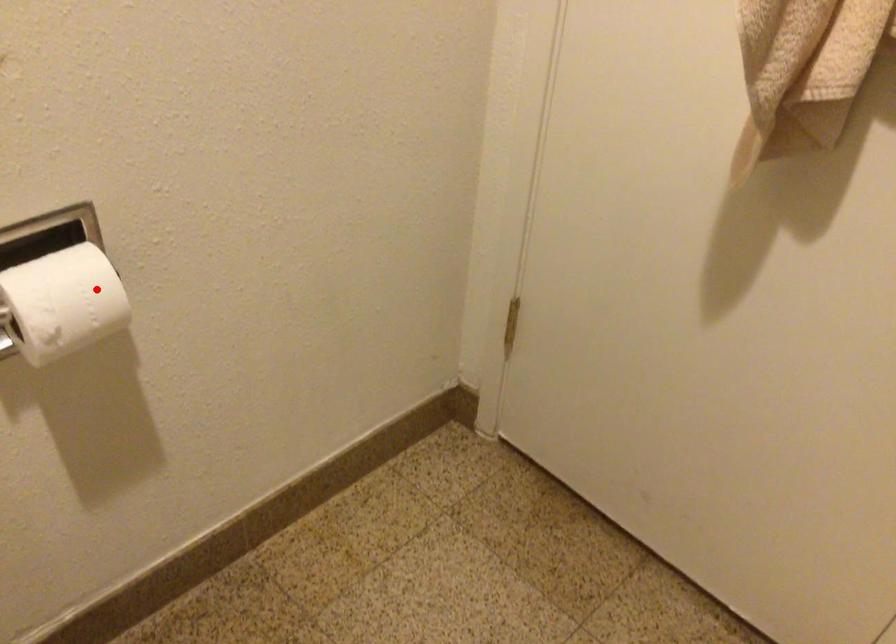
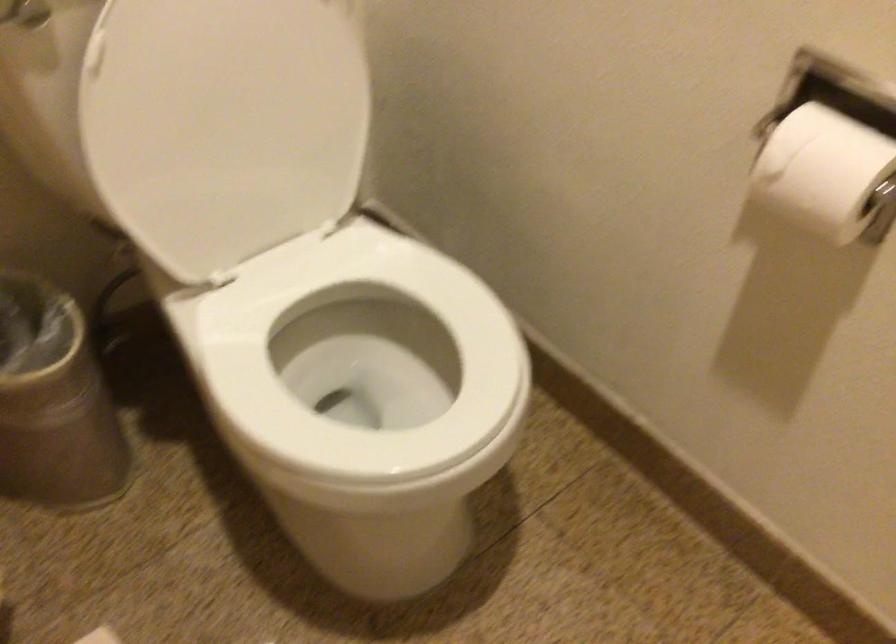
Where in the second image is the point corresponding to the highlighted location from the first image?

(824, 172)